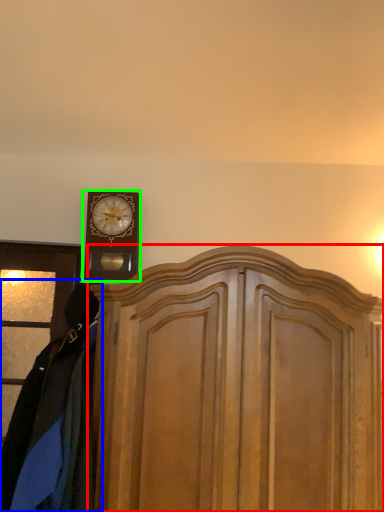
Question: Considering the real-world distances, which object is closest to dresser (highlighted by a red box)? clothing (highlighted by a blue box) or wall clock (highlighted by a green box).

Choices:
 (A) clothing
 (B) wall clock

Answer: (A)